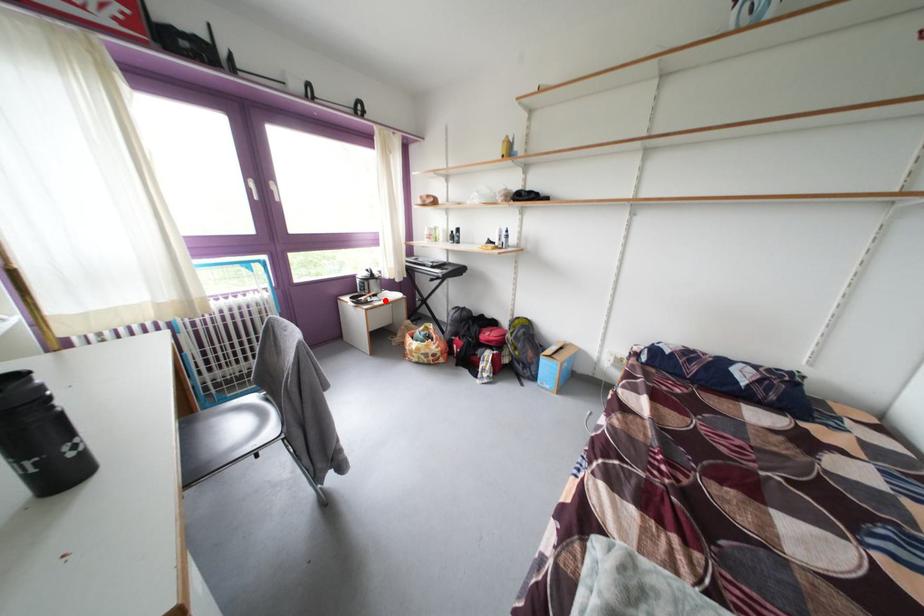
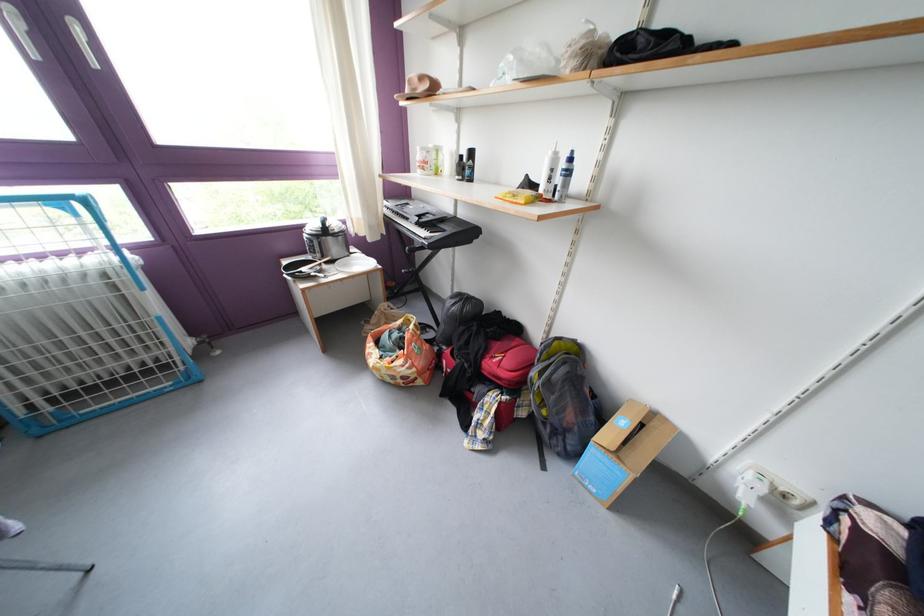
Question: I am providing you with two images of the same scene from different viewpoints. A red point is marked on the first image. Can you still see the location of the red point in image 2?

Choices:
 (A) Yes
 (B) No

Answer: (A)